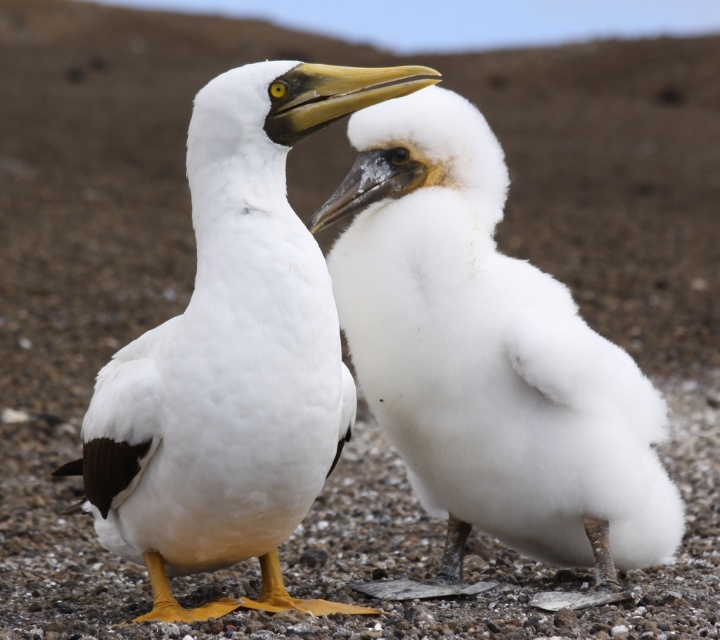
Is the position of white fluffy bird at center less distant than that of matte white beak at center?

No, it is not.

What do you see at coordinates (492, 362) in the screenshot? This screenshot has width=720, height=640. I see `white fluffy bird at center` at bounding box center [492, 362].

Describe the element at coordinates (492, 362) in the screenshot. The image size is (720, 640). I see `white fluffy bird at center` at that location.

Where is `white fluffy bird at center`? white fluffy bird at center is located at coordinates (492, 362).

Does white matte bird at center appear under matte white beak at center?

Indeed, white matte bird at center is positioned under matte white beak at center.

Between point (318, 324) and point (392, 166), which one is positioned behind?

Point (392, 166)

At what (x,y) coordinates should I click in order to perform the action: click on white matte bird at center. Please return your answer as a coordinate pair (x, y). Looking at the image, I should click on (234, 353).

Which of these two, matte yellow beak at center or matte white beak at center, stands shorter?

Standing shorter between the two is matte yellow beak at center.

Measure the distance between point (325, 99) and camera.

Point (325, 99) and camera are 2.26 meters apart from each other.

The height and width of the screenshot is (640, 720). I want to click on matte yellow beak at center, so (x=333, y=93).